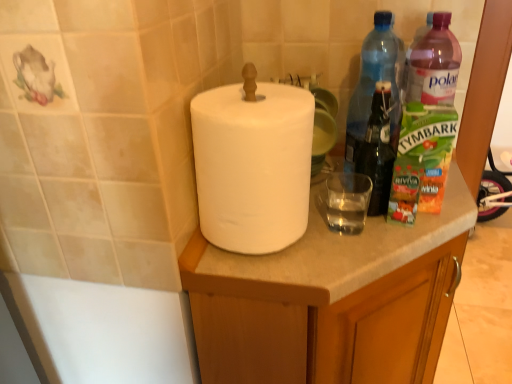
Question: Is white matte cabinet at center spatially inside pink plastic bottle at right, which ranks as the 2th bottle in left-to-right order, or outside of it?

Choices:
 (A) inside
 (B) outside

Answer: (B)

Question: Would you say white matte cabinet at center is to the left or to the right of pink plastic bottle at right, arranged as the first bottle when viewed from the right, in the picture?

Choices:
 (A) left
 (B) right

Answer: (A)

Question: Which of these objects is positioned closest to the pink plastic bottle at right, which ranks as the 2th bottle in left-to-right order?

Choices:
 (A) transparent glass at center
 (B) transparent plastic bottle at upper right, the second bottle in the right-to-left sequence
 (C) white matte paper towel at center
 (D) white matte cabinet at center

Answer: (B)

Question: Which is farther from the transparent plastic bottle at upper right, arranged as the 1th bottle when viewed from the left?

Choices:
 (A) pink plastic bottle at right, which ranks as the 2th bottle in left-to-right order
 (B) white matte paper towel at center
 (C) white matte cabinet at center
 (D) transparent glass at center

Answer: (B)